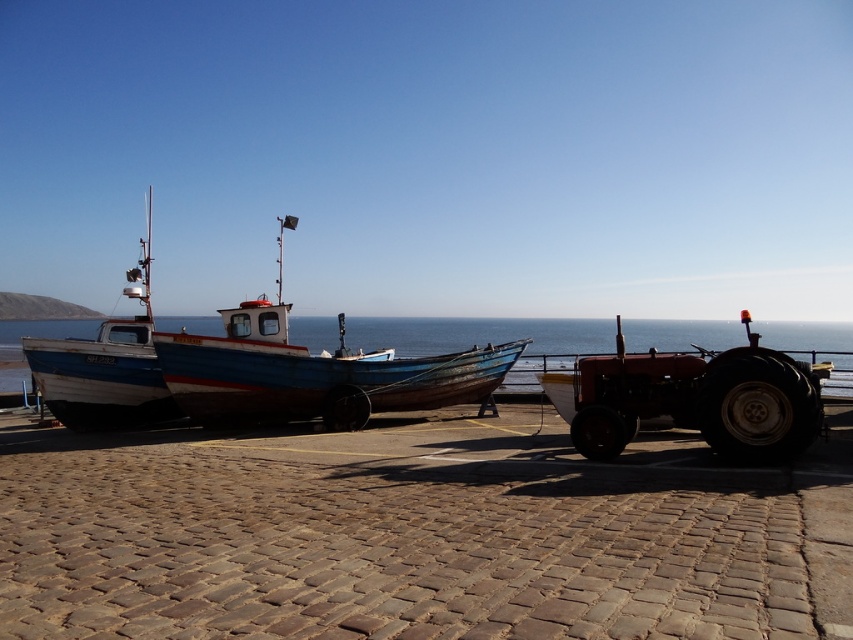
Who is lower down, matte red tractor at right or white wooden boat at left?

Positioned lower is matte red tractor at right.

Is point (767, 349) positioned before point (112, 356)?

Yes, it is in front of point (112, 356).

Who is more distant from viewer, (550, 390) or (111, 388)?

Point (111, 388)

Locate an element on the screen. The height and width of the screenshot is (640, 853). matte red tractor at right is located at coordinates (693, 397).

Can you confirm if wooden blue boat at center is wider than matte red tractor at right?

Correct, the width of wooden blue boat at center exceeds that of matte red tractor at right.

Is point (265, 417) closer to camera compared to point (730, 428)?

No, it is behind (730, 428).

Find the location of a particular element. The image size is (853, 640). wooden blue boat at center is located at coordinates (312, 372).

Is wooden blue boat at center closer to camera compared to white wooden boat at left?

Yes, wooden blue boat at center is in front of white wooden boat at left.

From the picture: Does wooden blue boat at center lie behind white wooden boat at left?

No, wooden blue boat at center is in front of white wooden boat at left.

What are the coordinates of `wooden blue boat at center` in the screenshot? It's located at (312, 372).

I want to click on wooden blue boat at center, so click(312, 372).